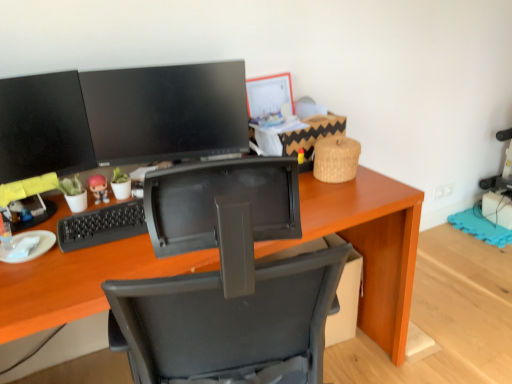
Question: Is matte black monitor at upper center, marked as the second computer monitor in a left-to-right arrangement, at the left side of wooden desk at center?

Choices:
 (A) no
 (B) yes

Answer: (B)

Question: From a real-world perspective, is matte black monitor at upper center, positioned as the first computer monitor in right-to-left order, positioned over wooden desk at center based on gravity?

Choices:
 (A) no
 (B) yes

Answer: (B)

Question: Is matte black monitor at upper center, marked as the second computer monitor in a left-to-right arrangement, at the right side of wooden desk at center?

Choices:
 (A) no
 (B) yes

Answer: (A)

Question: From the image's perspective, is matte black monitor at upper center, positioned as the first computer monitor in right-to-left order, located beneath wooden desk at center?

Choices:
 (A) no
 (B) yes

Answer: (A)

Question: Is matte black monitor at upper center, marked as the second computer monitor in a left-to-right arrangement, outside of wooden desk at center?

Choices:
 (A) no
 (B) yes

Answer: (B)

Question: Is wooden desk at center inside matte black monitor at upper center, positioned as the first computer monitor in right-to-left order?

Choices:
 (A) no
 (B) yes

Answer: (A)

Question: Is matte black monitor at left, which is the 2th computer monitor from right to left, oriented towards matte plastic figurine at center?

Choices:
 (A) yes
 (B) no

Answer: (B)

Question: From a real-world perspective, is matte black monitor at left, which appears as the 1th computer monitor when viewed from the left, over matte plastic figurine at center?

Choices:
 (A) yes
 (B) no

Answer: (A)

Question: Considering the relative sizes of matte black monitor at left, which appears as the 1th computer monitor when viewed from the left, and matte plastic figurine at center in the image provided, is matte black monitor at left, which appears as the 1th computer monitor when viewed from the left, smaller than matte plastic figurine at center?

Choices:
 (A) no
 (B) yes

Answer: (A)

Question: Is matte plastic figurine at center surrounded by matte black monitor at left, which is the 2th computer monitor from right to left?

Choices:
 (A) no
 (B) yes

Answer: (A)

Question: Can you confirm if matte black monitor at left, which appears as the 1th computer monitor when viewed from the left, is positioned to the right of matte plastic figurine at center?

Choices:
 (A) yes
 (B) no

Answer: (B)

Question: Is matte black monitor at left, which appears as the 1th computer monitor when viewed from the left, looking in the opposite direction of matte plastic figurine at center?

Choices:
 (A) yes
 (B) no

Answer: (B)

Question: Is matte black monitor at left, which is the 2th computer monitor from right to left, facing towards wooden desk at center?

Choices:
 (A) no
 (B) yes

Answer: (A)